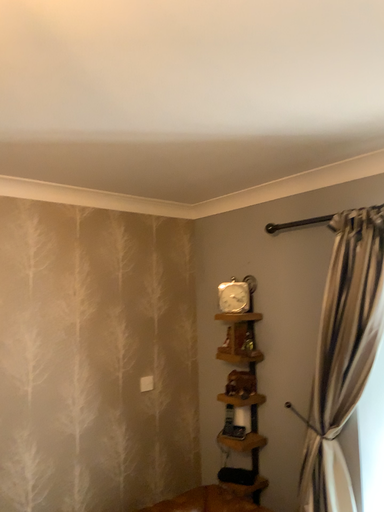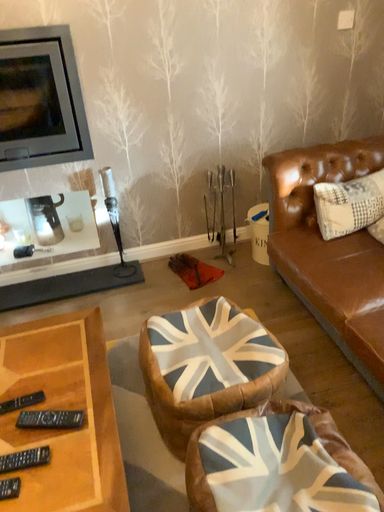
Question: Which way did the camera rotate in the video?

Choices:
 (A) rotated right
 (B) rotated left

Answer: (B)